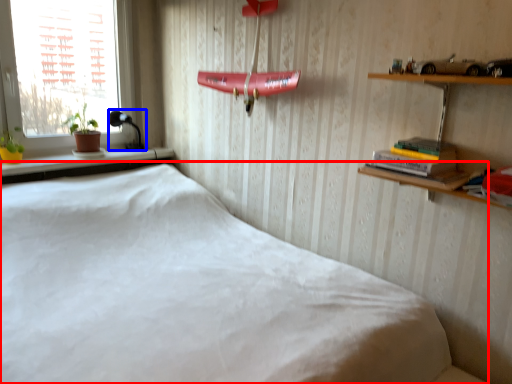
Question: Among these objects, which one is nearest to the camera, bed (highlighted by a red box) or lamp (highlighted by a blue box)?

Choices:
 (A) bed
 (B) lamp

Answer: (A)